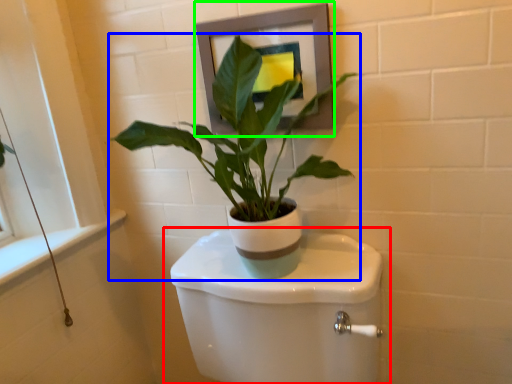
Question: Based on their relative distances, which object is nearer to toilet (highlighted by a red box)? Choose from houseplant (highlighted by a blue box) and picture frame (highlighted by a green box).

Choices:
 (A) houseplant
 (B) picture frame

Answer: (A)